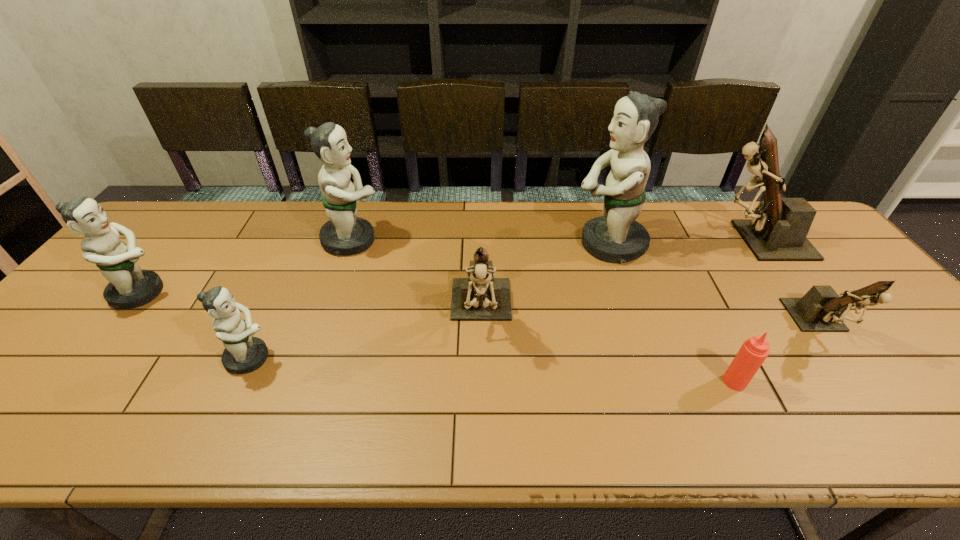
Where is `vacant region located on the front-facing side of the fourth figurine from left to right`? Image resolution: width=960 pixels, height=540 pixels. vacant region located on the front-facing side of the fourth figurine from left to right is located at coordinates (482, 439).

Identify the location of free space located 0.140m on the front-facing side of the smallest brown figurine. Image resolution: width=960 pixels, height=540 pixels. (882, 409).

This screenshot has width=960, height=540. Identify the location of vacant region located on the front-facing side of the smallest green figurine. (402, 358).

This screenshot has height=540, width=960. I want to click on vacant region located on the right of the third object from right to left, so click(x=875, y=382).

You are a GUI agent. You are given a task and a screenshot of the screen. Output one action in this format:
    pyautogui.click(x=<x>, y=<y>)
    Task: Click on the object present at the left edge
    The image size is (960, 540).
    Given the screenshot: What is the action you would take?
    pyautogui.click(x=129, y=286)

At what (x,y) coordinates should I click in order to perform the action: click on object that is at the far right corner. Please return your answer as a coordinate pair (x, y). Looking at the image, I should click on (778, 229).

This screenshot has width=960, height=540. I want to click on free location at the far edge, so click(419, 211).

Identify the location of blank space at the near edge of the desktop. (343, 447).

Image resolution: width=960 pixels, height=540 pixels. I want to click on free space at the left edge of the desktop, so click(73, 312).

In order to click on vacant space at the far left corner of the desktop in this screenshot , I will do `click(152, 220)`.